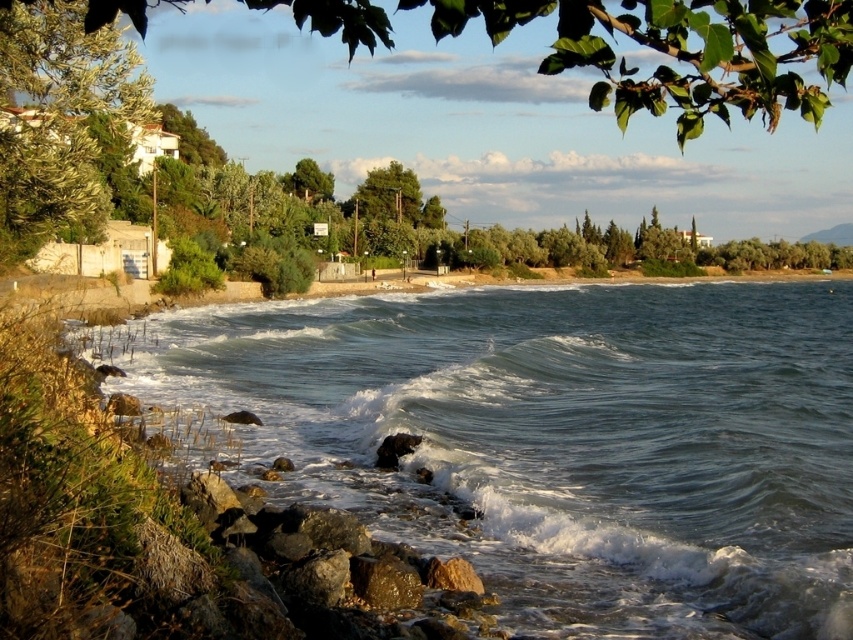
Is point (654, 593) in front of point (96, 8)?

No, (654, 593) is behind (96, 8).

What do you see at coordinates (558, 438) in the screenshot? The width and height of the screenshot is (853, 640). I see `clear blue water at center` at bounding box center [558, 438].

In order to click on clear blue water at center in this screenshot , I will do `click(558, 438)`.

Looking at this image, can you confirm if green leafy tree at upper center is positioned to the left of green leafy tree at upper left?

In fact, green leafy tree at upper center is to the right of green leafy tree at upper left.

Looking at this image, is green leafy tree at upper center shorter than green leafy tree at upper left?

No, green leafy tree at upper center is not shorter than green leafy tree at upper left.

Is point (804, 29) less distant than point (93, 96)?

That is True.

Locate an element on the screen. green leafy tree at upper center is located at coordinates (682, 51).

Which is behind, point (560, 339) or point (45, 204)?

Positioned behind is point (560, 339).

Describe the element at coordinates (558, 438) in the screenshot. I see `clear blue water at center` at that location.

Between point (776, 497) and point (51, 193), which one is positioned in front?

Positioned in front is point (776, 497).

This screenshot has height=640, width=853. What are the coordinates of `clear blue water at center` in the screenshot? It's located at point(558,438).